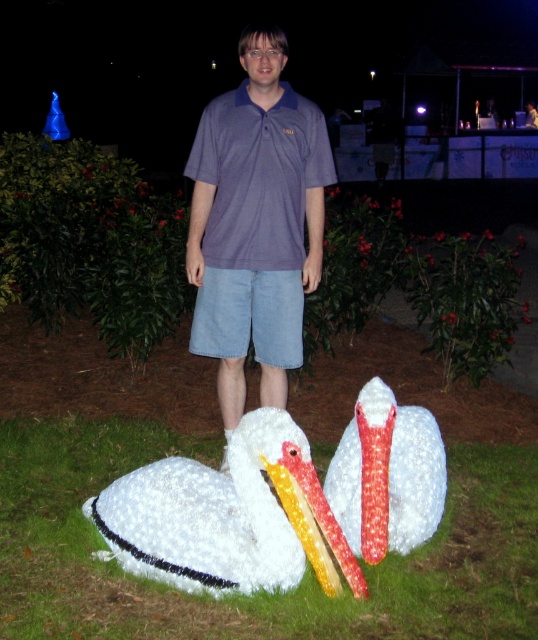
You are an artist planning to paint the scene. You have a limited amount of white paint. Which object should you use less white paint for, the matte purple shirt at center or the white fluffy swan at lower left?

The matte purple shirt at center is larger in size than the white fluffy swan at lower left, so you should use less white paint for the white fluffy swan at lower left since it is smaller.

You are a photographer trying to capture the scene with the two pelican sculptures. You notice the white fluffy grass at lower center and the matte purple shirt at center. Which object is closer to the left edge of your camera frame?

The white fluffy grass at lower center is positioned on the left side of matte purple shirt at center, so it is closer to the left edge of the camera frame.

You are a photographer positioned at the origin point in this nighttime scene. You want to capture a photo that includes both the person between the two pelican sculptures and the point at coordinates point (222, 321) and point (399, 481). Which point should you focus on first to ensure both are in frame?

Since point (222, 321) is behind point (399, 481), you should focus on point (399, 481) first to ensure both points are within the camera frame.